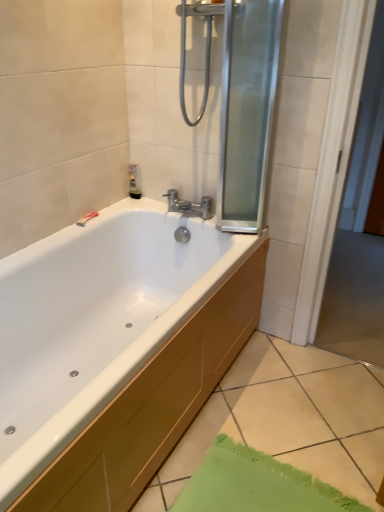
Question: From a real-world perspective, is transparent glass screen door at upper right positioned under translucent plastic tube at upper left based on gravity?

Choices:
 (A) no
 (B) yes

Answer: (A)

Question: Is transparent glass screen door at upper right thinner than translucent plastic tube at upper left?

Choices:
 (A) yes
 (B) no

Answer: (B)

Question: Is transparent glass screen door at upper right wider than translucent plastic tube at upper left?

Choices:
 (A) no
 (B) yes

Answer: (B)

Question: Is transparent glass screen door at upper right taller than translucent plastic tube at upper left?

Choices:
 (A) yes
 (B) no

Answer: (A)

Question: Is the position of transparent glass screen door at upper right more distant than that of translucent plastic tube at upper left?

Choices:
 (A) yes
 (B) no

Answer: (B)

Question: Considering the positions of transparent glass screen door at upper right and chrome metallic faucet at center in the image, is transparent glass screen door at upper right taller or shorter than chrome metallic faucet at center?

Choices:
 (A) tall
 (B) short

Answer: (A)

Question: Is point (269, 90) positioned closer to the camera than point (170, 202)?

Choices:
 (A) farther
 (B) closer

Answer: (B)

Question: From the image's perspective, is transparent glass screen door at upper right located above or below chrome metallic faucet at center?

Choices:
 (A) below
 (B) above

Answer: (B)

Question: Looking at the image, does transparent glass screen door at upper right seem bigger or smaller compared to chrome metallic faucet at center?

Choices:
 (A) big
 (B) small

Answer: (A)

Question: Is transparent glass screen door at upper right in front of or behind white glossy bathtub at lower left in the image?

Choices:
 (A) behind
 (B) front

Answer: (A)

Question: From the image's perspective, relative to white glossy bathtub at lower left, is transparent glass screen door at upper right above or below?

Choices:
 (A) below
 (B) above

Answer: (B)

Question: Is transparent glass screen door at upper right to the left or to the right of white glossy bathtub at lower left in the image?

Choices:
 (A) left
 (B) right

Answer: (B)

Question: In terms of width, does transparent glass screen door at upper right look wider or thinner when compared to white glossy bathtub at lower left?

Choices:
 (A) wide
 (B) thin

Answer: (B)

Question: Is white glossy bathtub at lower left to the left or to the right of transparent glass screen door at upper right in the image?

Choices:
 (A) right
 (B) left

Answer: (B)

Question: From the image's perspective, relative to transparent glass screen door at upper right, is white glossy bathtub at lower left above or below?

Choices:
 (A) below
 (B) above

Answer: (A)